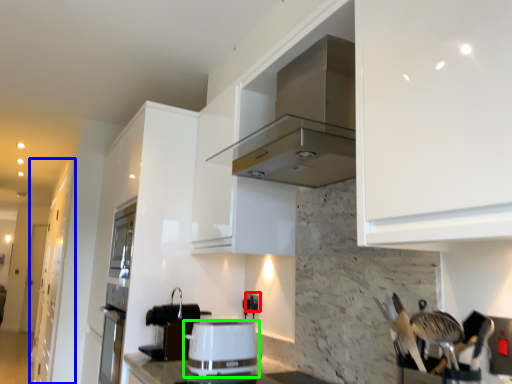
Question: Based on their relative distances, which object is nearer to electric outlet (highlighted by a red box)? Choose from cabinetry (highlighted by a blue box) and kitchen appliance (highlighted by a green box).

Choices:
 (A) cabinetry
 (B) kitchen appliance

Answer: (B)